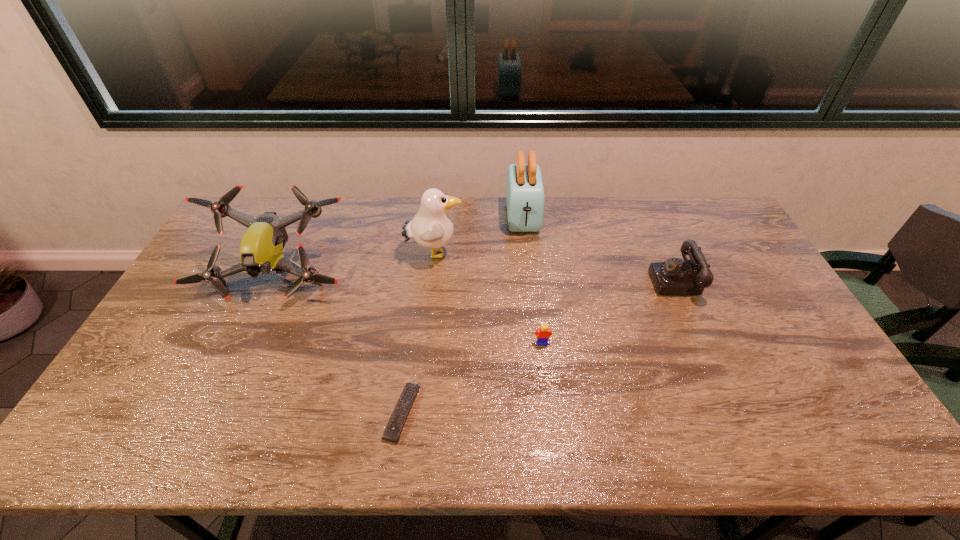
Identify the location of blank area located on the front-facing side of the drone. (233, 370).

I want to click on vacant area situated 0.320m on the beak of the gull, so click(x=559, y=253).

Where is `vacant space located 0.060m on the dial of the telephone`? The height and width of the screenshot is (540, 960). vacant space located 0.060m on the dial of the telephone is located at coordinates (632, 280).

What are the coordinates of `vacant space situated 0.180m on the dial of the telephone` in the screenshot? It's located at (593, 280).

Where is `vacant area located on the dial of the telephone`? vacant area located on the dial of the telephone is located at coordinates (562, 280).

This screenshot has height=540, width=960. Find the location of `free space located on the front-facing side of the Lego`. free space located on the front-facing side of the Lego is located at coordinates (544, 361).

The height and width of the screenshot is (540, 960). In order to click on vacant point located 0.110m on the left of the remote control in this screenshot , I will do `click(342, 412)`.

Where is `object that is positioned at the far edge`? The height and width of the screenshot is (540, 960). object that is positioned at the far edge is located at coordinates (525, 197).

At what (x,y) coordinates should I click in order to perform the action: click on object that is at the near edge. Please return your answer as a coordinate pair (x, y). The height and width of the screenshot is (540, 960). Looking at the image, I should click on (392, 432).

This screenshot has width=960, height=540. I want to click on object that is at the left edge, so click(x=261, y=249).